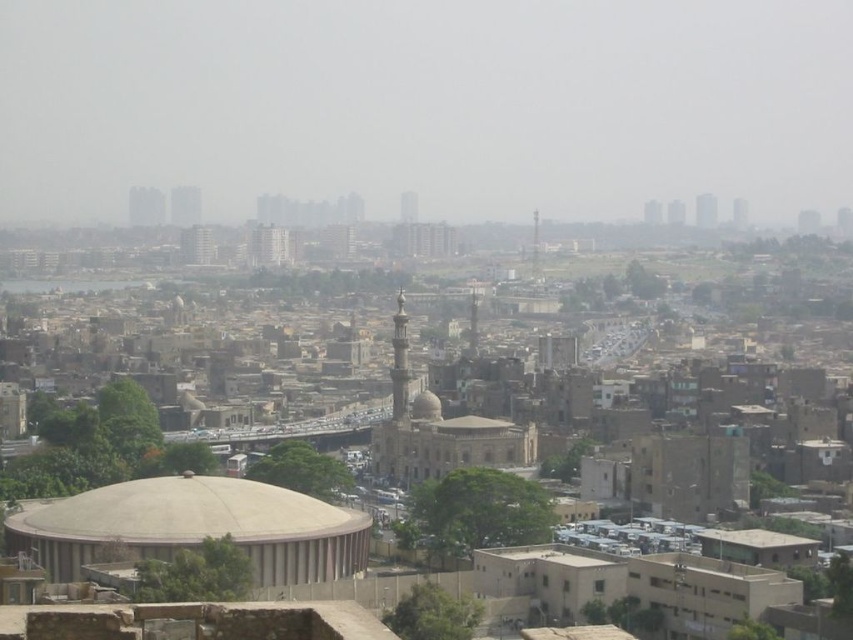
Can you confirm if beige concrete dome at center is smaller than light beige stone dome at center?

Actually, beige concrete dome at center might be larger than light beige stone dome at center.

Between beige concrete dome at center and light beige stone dome at center, which one has less height?

light beige stone dome at center

What do you see at coordinates (193, 528) in the screenshot? Image resolution: width=853 pixels, height=640 pixels. I see `beige concrete dome at center` at bounding box center [193, 528].

The width and height of the screenshot is (853, 640). What are the coordinates of `beige concrete dome at center` in the screenshot? It's located at (193, 528).

Does point (550, 188) come behind point (268, 577)?

Yes, point (550, 188) is behind point (268, 577).

Does transparent foggy skyline at upper center have a greater width compared to beige concrete dome at center?

Yes.

Which is in front, point (489, 72) or point (161, 556)?

Positioned in front is point (161, 556).

At what (x,y) coordinates should I click in order to perform the action: click on transparent foggy skyline at upper center. Please return your answer as a coordinate pair (x, y). The width and height of the screenshot is (853, 640). Looking at the image, I should click on (426, 106).

Is the position of transparent foggy skyline at upper center less distant than that of light beige stone dome at center?

No, transparent foggy skyline at upper center is behind light beige stone dome at center.

Between transparent foggy skyline at upper center and light beige stone dome at center, which one is positioned higher?

transparent foggy skyline at upper center

Who is more distant from viewer, [805,150] or [434,400]?

Positioned behind is point [805,150].

You are a GUI agent. You are given a task and a screenshot of the screen. Output one action in this format:
    pyautogui.click(x=<x>, y=<y>)
    Task: Click on the transparent foggy skyline at upper center
    
    Given the screenshot: What is the action you would take?
    pyautogui.click(x=426, y=106)